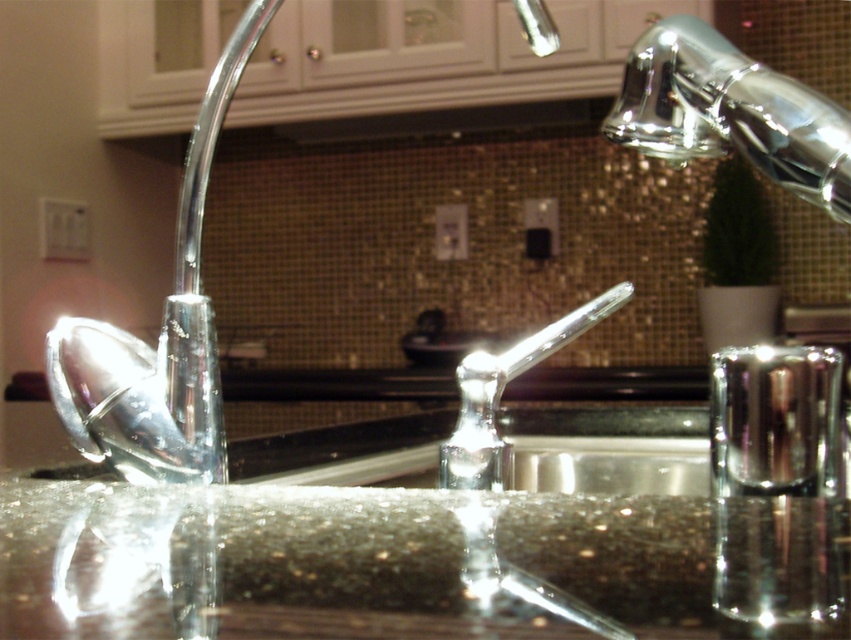
Question: Does shiny granite sink at center have a larger size compared to polished chrome faucet at center?

Choices:
 (A) yes
 (B) no

Answer: (A)

Question: Estimate the real-world distances between objects in this image. Which object is farther from the shiny granite sink at center?

Choices:
 (A) polished chrome faucet at center
 (B) chrome metallic faucet at upper right

Answer: (B)

Question: Is shiny granite sink at center thinner than chrome metallic faucet at upper right?

Choices:
 (A) no
 (B) yes

Answer: (A)

Question: Estimate the real-world distances between objects in this image. Which object is farther from the shiny granite sink at center?

Choices:
 (A) polished chrome faucet at center
 (B) chrome metallic faucet at upper right

Answer: (B)

Question: Which point is closer to the camera?

Choices:
 (A) (510, 552)
 (B) (530, 360)
 (C) (775, 163)

Answer: (A)

Question: From the image, what is the correct spatial relationship of shiny granite sink at center in relation to chrome metallic faucet at upper right?

Choices:
 (A) below
 (B) above

Answer: (A)